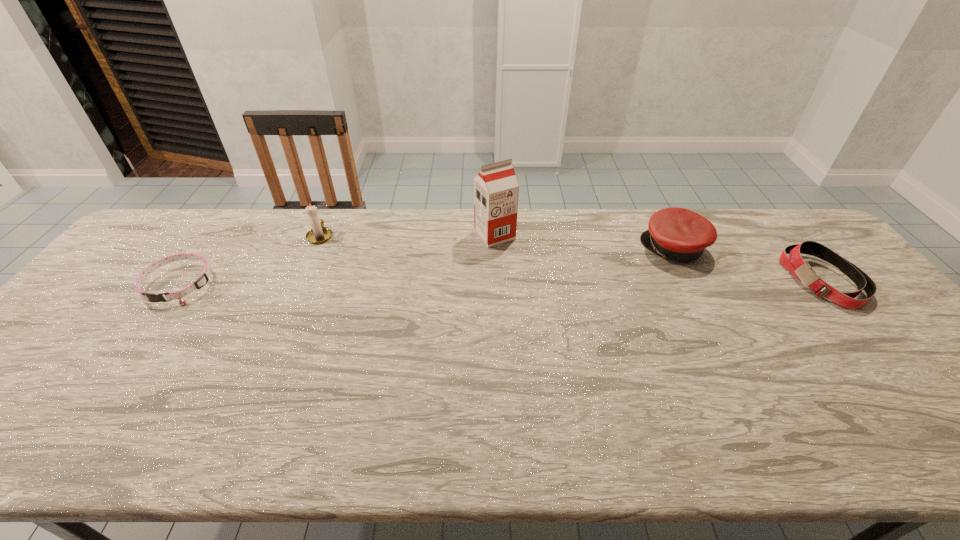
Identify the location of free space located 0.220m on the right of the tallest object. The width and height of the screenshot is (960, 540). tap(584, 235).

Locate an element on the screen. The height and width of the screenshot is (540, 960). free spot located 0.100m on the handle side of the second tallest object is located at coordinates (331, 209).

You are a GUI agent. You are given a task and a screenshot of the screen. Output one action in this format:
    pyautogui.click(x=<x>, y=<y>)
    Task: Click on the vacant space situated 0.070m on the handle side of the second tallest object
    
    Given the screenshot: What is the action you would take?
    pyautogui.click(x=329, y=214)

Find the location of a particular element. This screenshot has width=960, height=540. vacant space located on the handle side of the second tallest object is located at coordinates (331, 211).

Image resolution: width=960 pixels, height=540 pixels. Identify the location of vacant space positioned 0.180m at the front of the cap where the visor is located. click(586, 248).

You are a GUI agent. You are given a task and a screenshot of the screen. Output one action in this format:
    pyautogui.click(x=<x>, y=<y>)
    Task: Click on the free spot located 0.280m at the front of the cap where the visor is located
    The width and height of the screenshot is (960, 540).
    Given the screenshot: What is the action you would take?
    pyautogui.click(x=553, y=248)

At what (x,y) coordinates should I click in order to perform the action: click on free space located at the front of the cap where the visor is located. Please return your answer as a coordinate pair (x, y). This screenshot has height=540, width=960. Looking at the image, I should click on (515, 248).

Identify the location of vacant space located 0.250m on the back of the rightmost object. (764, 208).

This screenshot has height=540, width=960. I want to click on vacant point located with the buckle on the shortest object, so click(x=116, y=373).

This screenshot has width=960, height=540. In order to click on soya milk that is at the far edge in this screenshot , I will do `click(496, 190)`.